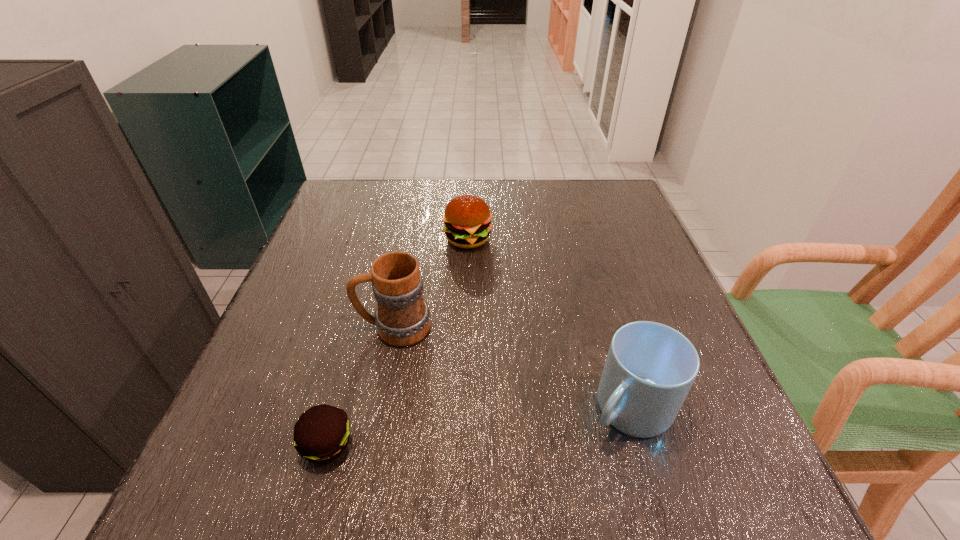
Where is `vacant space located 0.220m on the right of the patty`? vacant space located 0.220m on the right of the patty is located at coordinates (494, 444).

Locate an element on the screen. Image resolution: width=960 pixels, height=540 pixels. object that is at the near edge is located at coordinates (321, 434).

The image size is (960, 540). In order to click on object situated at the left edge in this screenshot , I will do `click(321, 434)`.

At what (x,y) coordinates should I click in order to perform the action: click on object that is at the right edge. Please return your answer as a coordinate pair (x, y). The height and width of the screenshot is (540, 960). Looking at the image, I should click on (650, 368).

Find the location of a particular element. This screenshot has height=540, width=960. object that is at the near left corner is located at coordinates (321, 434).

Find the location of `vacant point at the far edge`. vacant point at the far edge is located at coordinates (528, 194).

At what (x,y) coordinates should I click in order to perform the action: click on free space at the left edge of the desktop. Please return your answer as a coordinate pair (x, y). This screenshot has height=540, width=960. Looking at the image, I should click on (289, 359).

In the image, there is a desktop. At what (x,y) coordinates should I click in order to perform the action: click on blank space at the right edge. Please return your answer as a coordinate pair (x, y). The width and height of the screenshot is (960, 540). Looking at the image, I should click on (632, 235).

In the image, there is a desktop. Identify the location of vacant space at the far left corner. (371, 198).

This screenshot has width=960, height=540. In order to click on free space at the far right corner in this screenshot , I will do `click(600, 200)`.